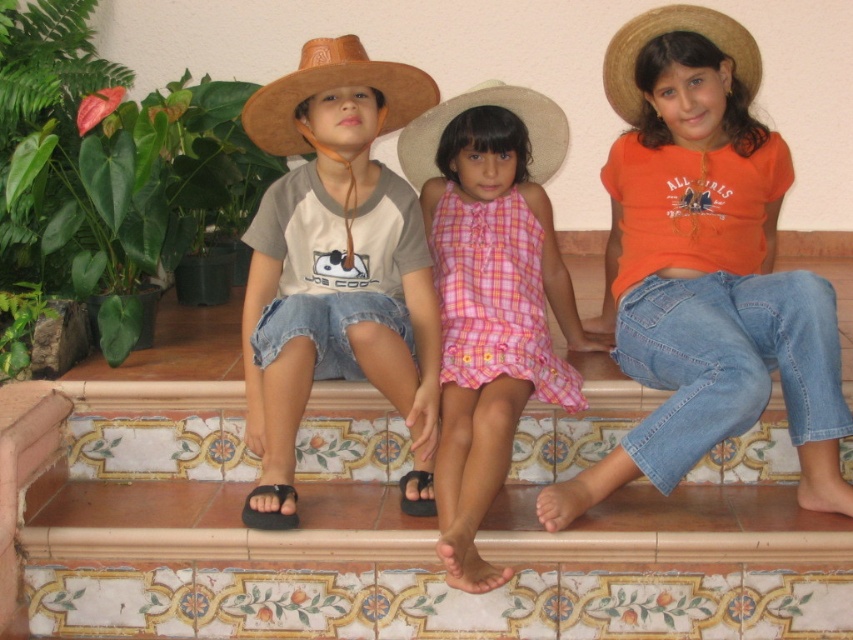
Question: Which point is closer to the camera?

Choices:
 (A) straw hat at center
 (B) orange cotton shirt at center
 (C) black synthetic sandal at lower center

Answer: (B)

Question: Which point is closer to the camera?

Choices:
 (A) brown leather hat at left
 (B) pink plaid dress at center
 (C) black synthetic sandal at lower center

Answer: (B)

Question: Which object is the closest to the black synthetic sandal at lower center?

Choices:
 (A) pink plaid dress at center
 (B) orange cotton shirt at center
 (C) brown woven cowboy hat at left
 (D) straw hat at upper right

Answer: (A)

Question: Can you confirm if brown leather hat at left is positioned to the right of straw hat at upper right?

Choices:
 (A) no
 (B) yes

Answer: (A)

Question: Is brown leather hat at left to the left of brown woven cowboy hat at left from the viewer's perspective?

Choices:
 (A) no
 (B) yes

Answer: (B)

Question: Can you confirm if orange cotton shirt at center is positioned above black rubber sandal at lower left?

Choices:
 (A) no
 (B) yes

Answer: (B)